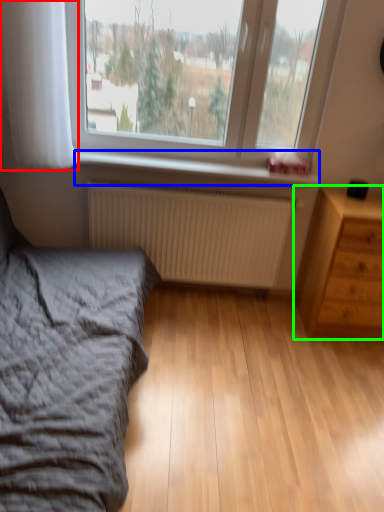
Question: Estimate the real-world distances between objects in this image. Which object is farther from curtain (highlighted by a red box), window sill (highlighted by a blue box) or chest of drawers (highlighted by a green box)?

Choices:
 (A) window sill
 (B) chest of drawers

Answer: (B)